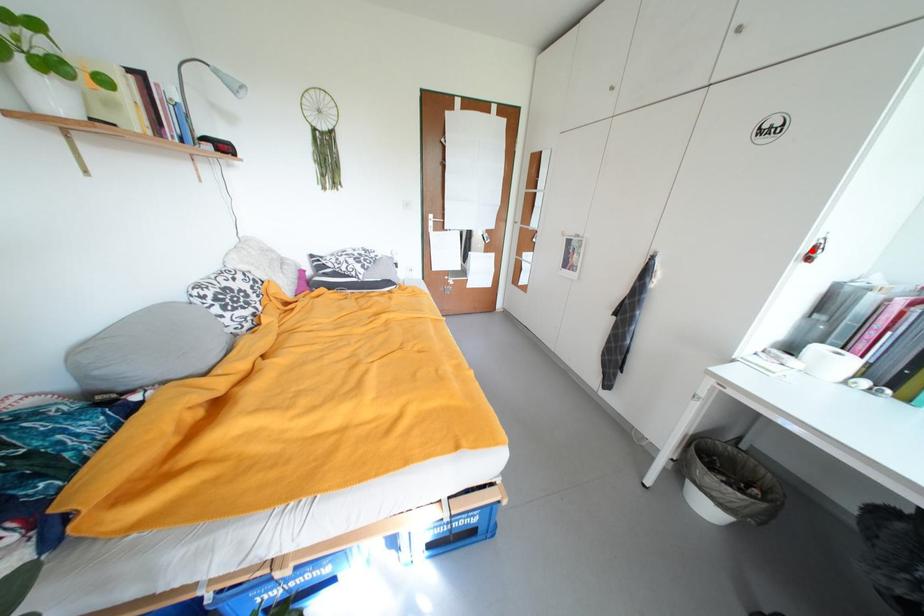
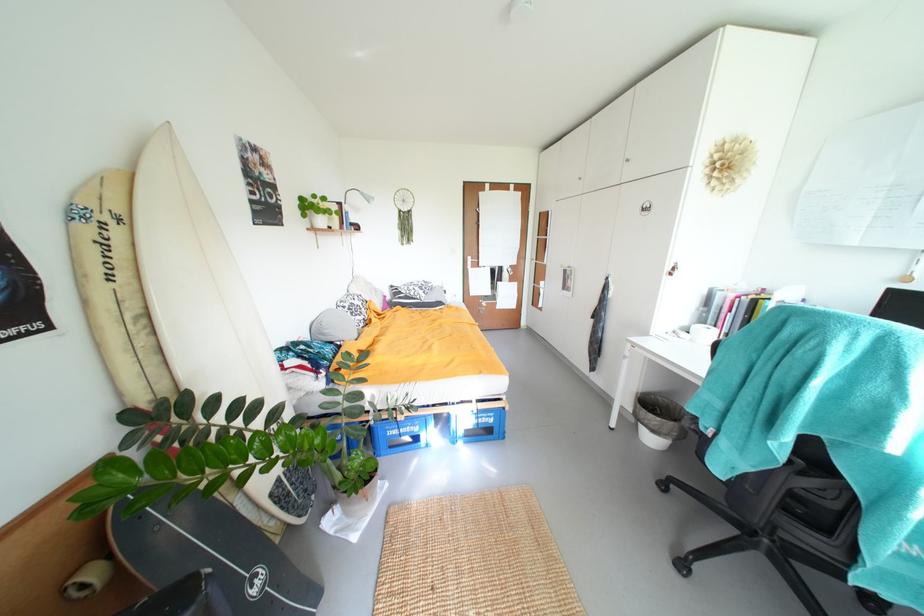
Where in the second image is the point corresponding to the highlighted location from the first image?

(675, 270)